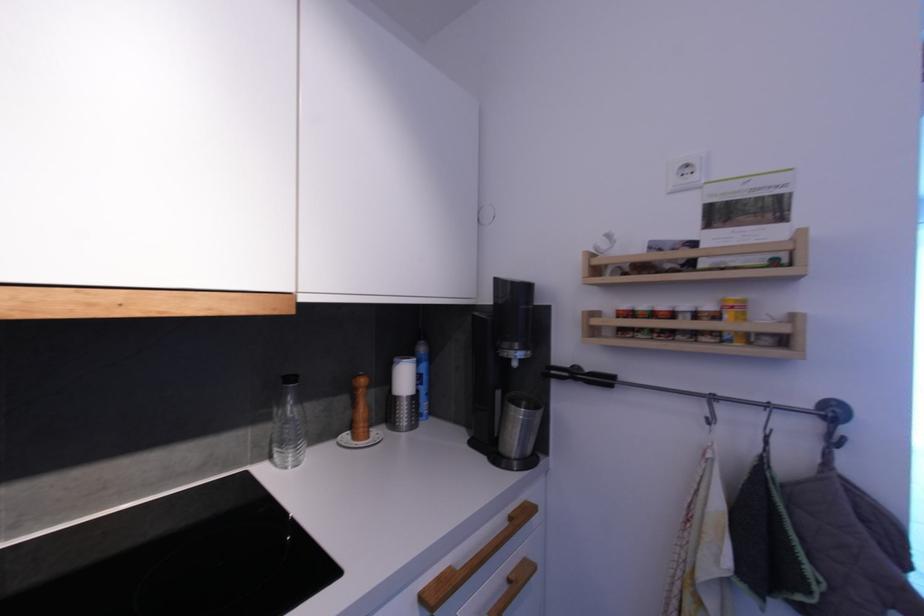
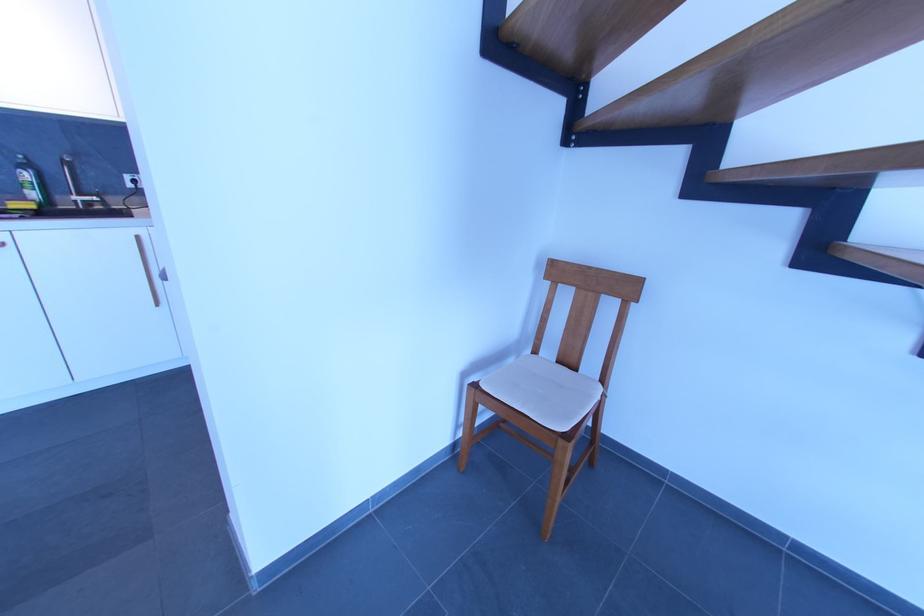
Question: I am providing you with two images of the same scene from different viewpoints. After the viewpoint changes to image2, which objects are now occluded?

Choices:
 (A) small pushpin
 (B) small spice jar
 (C) yellow sponge
 (D) wooden cabinet handle

Answer: (B)